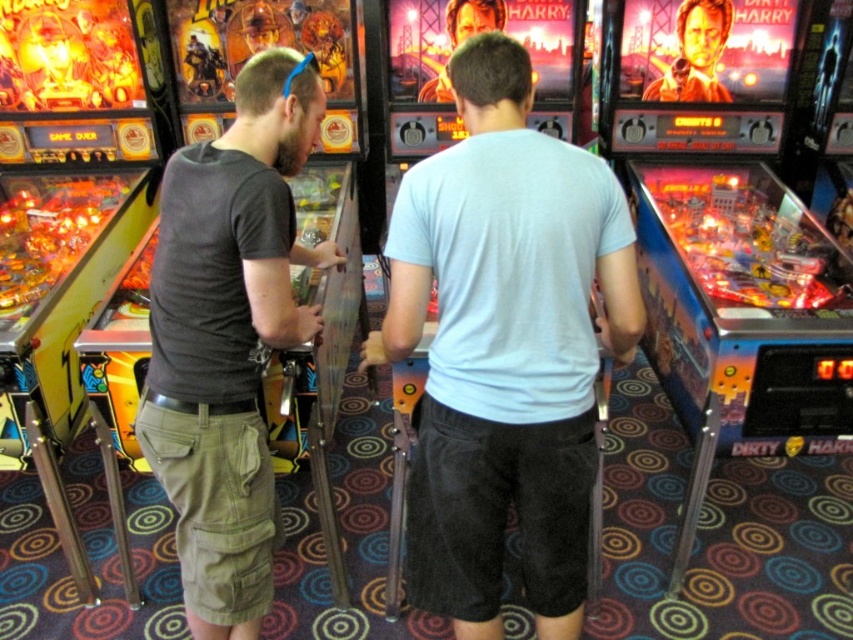
Question: Can you confirm if light blue t-shirt at center is positioned above smooth brown hair at upper center?

Choices:
 (A) yes
 (B) no

Answer: (B)

Question: Which is nearer to the smooth brown hair at upper center?

Choices:
 (A) smooth plastic face at center
 (B) light blue t-shirt at center
 (C) dark gray t-shirt at left

Answer: (A)

Question: Which point is farther to the camera?

Choices:
 (A) (485, 550)
 (B) (252, 316)
 (C) (714, 4)

Answer: (C)

Question: Is dark gray t-shirt at left smaller than smooth plastic face at center?

Choices:
 (A) no
 (B) yes

Answer: (A)

Question: Can you confirm if dark gray t-shirt at left is smaller than smooth brown hair at upper center?

Choices:
 (A) yes
 (B) no

Answer: (B)

Question: Which object appears closest to the camera in this image?

Choices:
 (A) dark gray t-shirt at left
 (B) smooth plastic face at center
 (C) light blue t-shirt at center

Answer: (C)